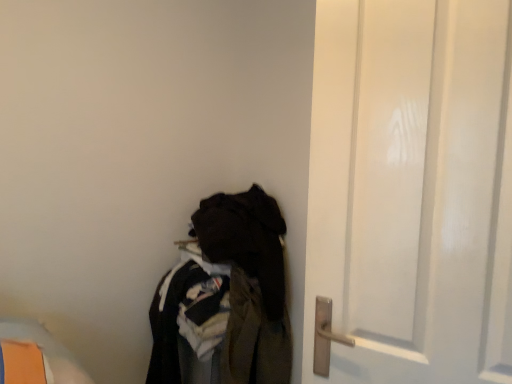
The image size is (512, 384). What are the coordinates of `dark fabric clothes at lower left` in the screenshot? It's located at (225, 297).

What is the approximate width of dark fabric clothes at lower left?

21.65 inches.

The width and height of the screenshot is (512, 384). Describe the element at coordinates (225, 297) in the screenshot. I see `dark fabric clothes at lower left` at that location.

Image resolution: width=512 pixels, height=384 pixels. What are the coordinates of `white matte door at right` in the screenshot? It's located at (412, 190).

Describe the element at coordinates (412, 190) in the screenshot. I see `white matte door at right` at that location.

What is the approximate width of white matte door at right?

The width of white matte door at right is 7.24 inches.

Where is `dark fabric clothes at lower left`? dark fabric clothes at lower left is located at coordinates (225, 297).

Which object is positioned more to the right, white matte door at right or dark fabric clothes at lower left?

From the viewer's perspective, white matte door at right appears more on the right side.

Is white matte door at right in front of or behind dark fabric clothes at lower left in the image?

In the image, white matte door at right appears in front of dark fabric clothes at lower left.

Which is in front, point (377, 352) or point (263, 376)?

Point (377, 352)

From the image's perspective, is white matte door at right located above or below dark fabric clothes at lower left?

Based on their image positions, white matte door at right is located above dark fabric clothes at lower left.

From a real-world perspective, is white matte door at right beneath dark fabric clothes at lower left?

No.

Considering the relative sizes of white matte door at right and dark fabric clothes at lower left in the image provided, is white matte door at right thinner than dark fabric clothes at lower left?

Yes.

Who is taller, white matte door at right or dark fabric clothes at lower left?

With more height is dark fabric clothes at lower left.

Is white matte door at right bigger than dark fabric clothes at lower left?

Incorrect, white matte door at right is not larger than dark fabric clothes at lower left.

Is white matte door at right outside of dark fabric clothes at lower left?

white matte door at right is positioned outside dark fabric clothes at lower left.

Is white matte door at right touching dark fabric clothes at lower left?

white matte door at right is not next to dark fabric clothes at lower left, and they're not touching.

Based on the photo, is white matte door at right positioned with its back to dark fabric clothes at lower left?

No, dark fabric clothes at lower left is not at the back of white matte door at right.

You are a GUI agent. You are given a task and a screenshot of the screen. Output one action in this format:
    pyautogui.click(x=<x>, y=<y>)
    Task: Click on the door in front of the dark fabric clothes at lower left
    The height and width of the screenshot is (384, 512).
    Given the screenshot: What is the action you would take?
    pyautogui.click(x=412, y=190)

Considering the relative positions of dark fabric clothes at lower left and white matte door at right in the image provided, is dark fabric clothes at lower left to the right of white matte door at right from the viewer's perspective?

Incorrect, dark fabric clothes at lower left is not on the right side of white matte door at right.

Is dark fabric clothes at lower left closer to camera compared to white matte door at right?

No, it is not.

Does point (251, 277) come behind point (309, 219)?

Yes, it is behind point (309, 219).

From the image's perspective, is dark fabric clothes at lower left located beneath white matte door at right?

Correct, dark fabric clothes at lower left appears lower than white matte door at right in the image.

From a real-world perspective, is dark fabric clothes at lower left beneath white matte door at right?

Yes, from a real-world perspective, dark fabric clothes at lower left is under white matte door at right.

Considering the sizes of objects dark fabric clothes at lower left and white matte door at right in the image provided, who is thinner, dark fabric clothes at lower left or white matte door at right?

white matte door at right is thinner.

Which of these two, dark fabric clothes at lower left or white matte door at right, stands taller?

dark fabric clothes at lower left is taller.

Is dark fabric clothes at lower left bigger or smaller than white matte door at right?

dark fabric clothes at lower left is bigger than white matte door at right.

Is dark fabric clothes at lower left located outside white matte door at right?

Yes, dark fabric clothes at lower left is outside of white matte door at right.

Is dark fabric clothes at lower left far away from white matte door at right?

No, there isn't a large distance between dark fabric clothes at lower left and white matte door at right.

Could you tell me if dark fabric clothes at lower left is turned towards white matte door at right?

No, dark fabric clothes at lower left is not aimed at white matte door at right.

Can you tell me how much dark fabric clothes at lower left and white matte door at right differ in facing direction?

The facing directions of dark fabric clothes at lower left and white matte door at right are 25.4 degrees apart.

Where is `closet behind the white matte door at right`? The width and height of the screenshot is (512, 384). closet behind the white matte door at right is located at coordinates (225, 297).

Identify the location of door above the dark fabric clothes at lower left (from a real-world perspective). (412, 190).

Where is `door lying above the dark fabric clothes at lower left (from the image's perspective)`? The width and height of the screenshot is (512, 384). door lying above the dark fabric clothes at lower left (from the image's perspective) is located at coordinates (412, 190).